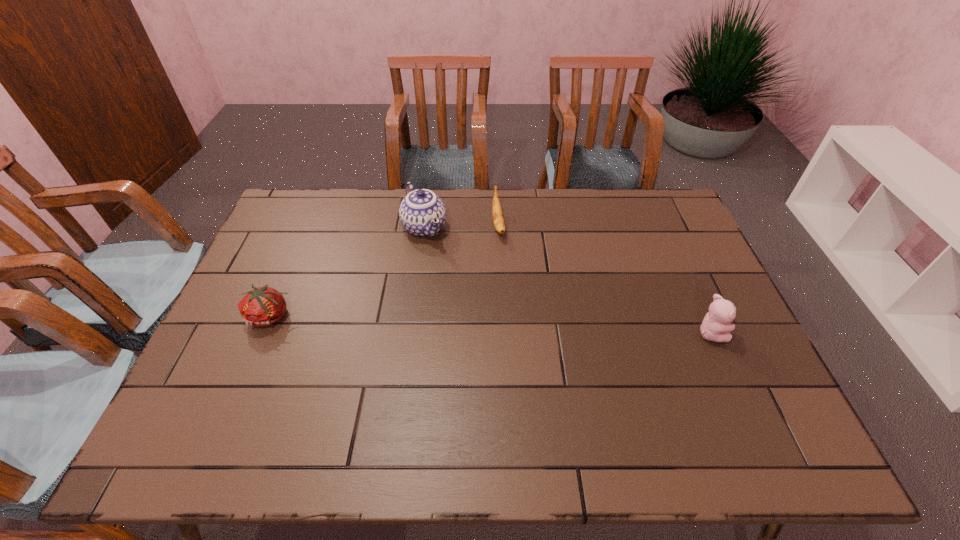
Image resolution: width=960 pixels, height=540 pixels. Find the location of `free space on the desktop that is between the leftmost object and the teddy bear and is positioned on the peel of the banana from the top`. free space on the desktop that is between the leftmost object and the teddy bear and is positioned on the peel of the banana from the top is located at coordinates (517, 325).

Find the location of a particular element. This screenshot has height=540, width=960. free space on the desktop that is between the tomato and the second tallest object and is positioned from the spout of the tallest object is located at coordinates (483, 324).